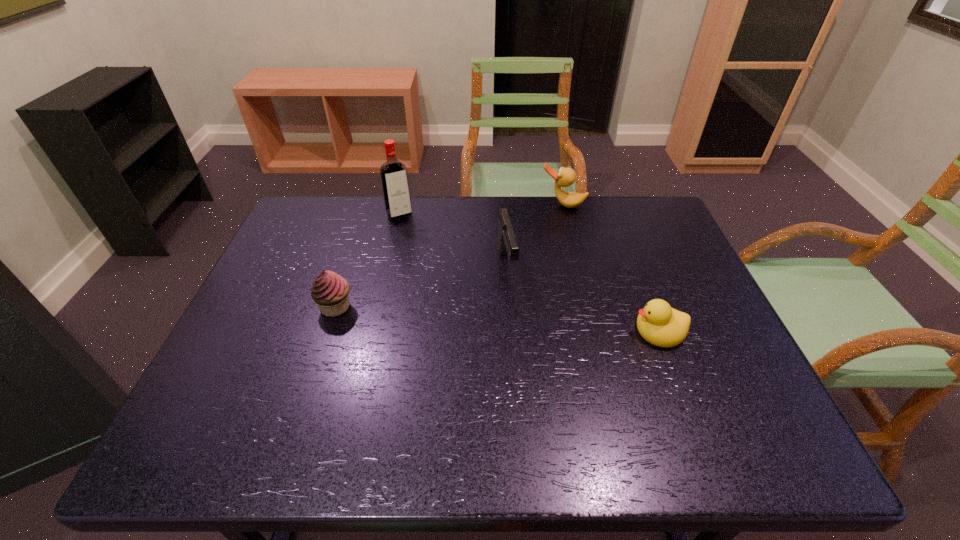
The image size is (960, 540). Identify the location of vacant space positioned 0.250m on the face of the shortest object. (529, 330).

I want to click on free location located on the face of the shortest object, so click(x=492, y=330).

Identify the location of vacant area situated on the front and back of the tallest object. (444, 287).

This screenshot has width=960, height=540. I want to click on free space located on the front and back of the tallest object, so click(x=445, y=289).

You are a GUI agent. You are given a task and a screenshot of the screen. Output one action in this format:
    pyautogui.click(x=<x>, y=<y>)
    Task: Click on the vacant area located on the front and back of the tallest object
    The height and width of the screenshot is (540, 960).
    Given the screenshot: What is the action you would take?
    pyautogui.click(x=449, y=297)

At what (x,y) coordinates should I click in order to perform the action: click on vacant area situated on the beak of the duck. Please return your answer as a coordinate pair (x, y). This screenshot has height=540, width=960. Looking at the image, I should click on (540, 266).

I want to click on vacant space located on the beak of the duck, so [x=534, y=282].

I want to click on blank space located 0.260m on the beak of the duck, so click(x=540, y=261).

In order to click on free point located 0.200m aim along the barrel of the pistol in this screenshot , I will do pyautogui.click(x=525, y=347).

Image resolution: width=960 pixels, height=540 pixels. Identify the location of vacant space located 0.180m aim along the barrel of the pistol. (523, 340).